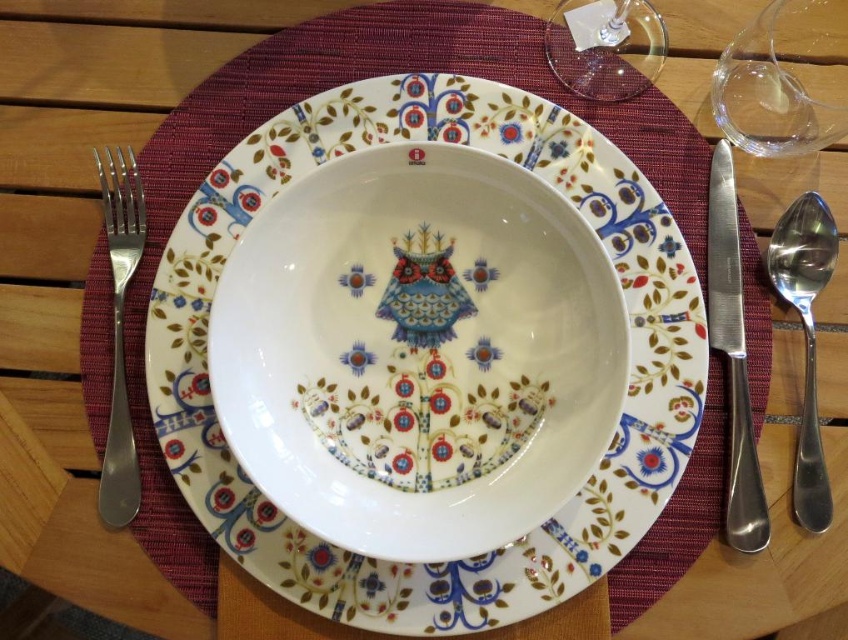
Is polished silver spoon at right taller than satin silver fork at left?

Incorrect, polished silver spoon at right's height is not larger of satin silver fork at left's.

Is point (801, 266) closer to camera compared to point (106, 506)?

No, (801, 266) is behind (106, 506).

Does point (807, 330) come behind point (109, 422)?

Yes, point (807, 330) is farther from viewer.

This screenshot has width=848, height=640. What are the coordinates of `polished silver spoon at right` in the screenshot? It's located at (805, 339).

Does point (540, 104) come in front of point (558, 61)?

Yes, it is.

Can you confirm if porcelain plate at center is shorter than transparent glass wine glass at upper center?

No.

What do you see at coordinates (617, 426) in the screenshot? I see `porcelain plate at center` at bounding box center [617, 426].

The width and height of the screenshot is (848, 640). In order to click on porcelain plate at center in this screenshot , I will do [617, 426].

Who is higher up, porcelain plate at center or transparent glass wine glass at upper right?

transparent glass wine glass at upper right is above.

Which is behind, point (665, 449) or point (813, 61)?

The point (813, 61) is more distant.

Does point (367, 92) lie in front of point (802, 129)?

That is False.

Locate an element on the screen. Image resolution: width=848 pixels, height=640 pixels. porcelain plate at center is located at coordinates (617, 426).